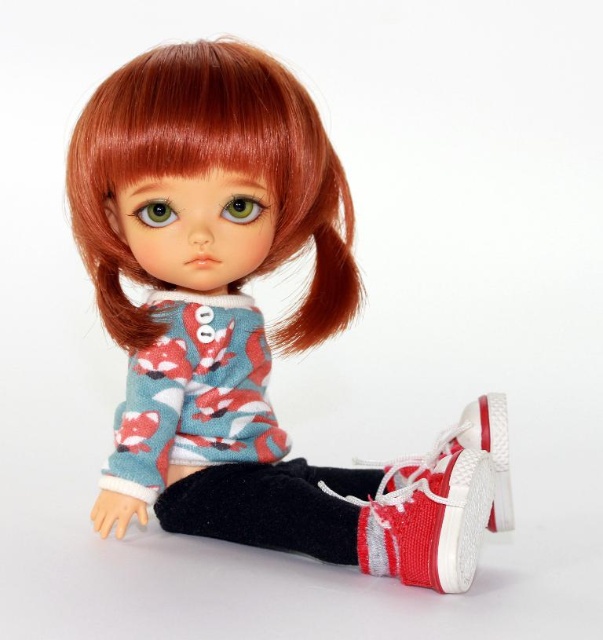
Question: Which point is farther to the camera?

Choices:
 (A) teal fox-patterned sweater at center
 (B) shiny orange hair at upper center
 (C) red canvas sneaker at lower right
 (D) matte fabric doll at center

Answer: (A)

Question: Is matte fabric doll at center wider than velvet black sock at lower center?

Choices:
 (A) no
 (B) yes

Answer: (B)

Question: Can you confirm if teal fox-patterned sweater at center is positioned above red canvas sneaker at lower right?

Choices:
 (A) yes
 (B) no

Answer: (A)

Question: Estimate the real-world distances between objects in this image. Which object is farther from the teal fox-patterned sweater at center?

Choices:
 (A) shiny orange hair at upper center
 (B) matte fabric doll at center
 (C) velvet black sock at lower center

Answer: (A)

Question: Among these objects, which one is farthest from the camera?

Choices:
 (A) teal fox-patterned sweater at center
 (B) shiny orange hair at upper center

Answer: (A)

Question: Can you confirm if matte fabric doll at center is bigger than red canvas sneaker at lower right?

Choices:
 (A) no
 (B) yes

Answer: (B)